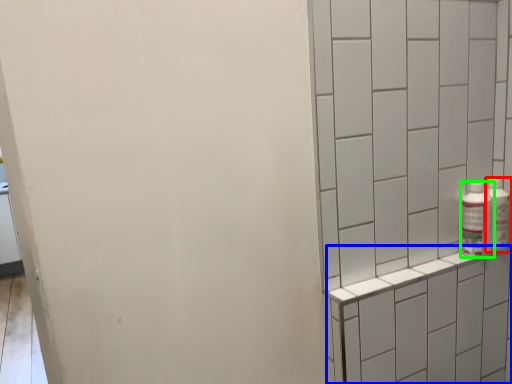
Question: Which object is positioned farthest from bottle (highlighted by a red box)? Select from shelf (highlighted by a blue box) and bottle (highlighted by a green box).

Choices:
 (A) shelf
 (B) bottle

Answer: (A)